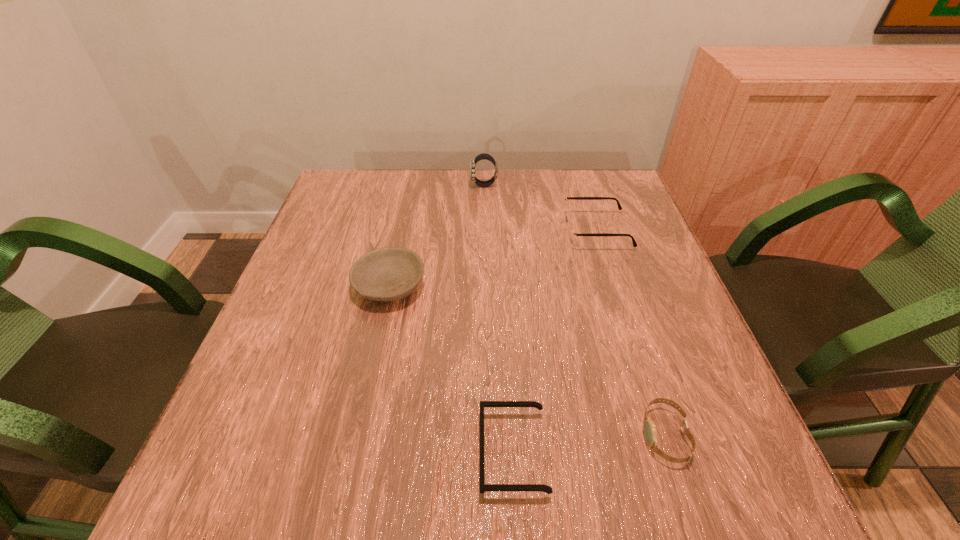
Identify the location of vacant space that satisfies the following two spatial constraints: 1. on the face of the farther watch; 2. on the front side of the leftmost object. (485, 286).